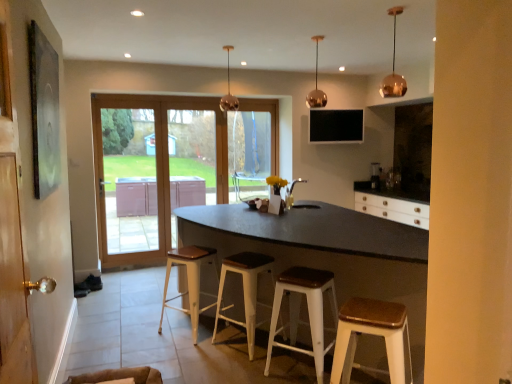
Question: Is point (207, 248) closer or farther from the camera than point (262, 127)?

Choices:
 (A) farther
 (B) closer

Answer: (B)

Question: From a real-world perspective, is white wood stool at center, placed as the first stool when sorted from back to front, physically located above or below transparent glass window at center?

Choices:
 (A) below
 (B) above

Answer: (A)

Question: Considering the real-world distances, which object is closest to the metallic gold pendant light at upper center, arranged as the first light fixture when viewed from the left?

Choices:
 (A) matte glass door at center
 (B) white wood stool at lower right, which ranks as the fourth stool in back-to-front order
 (C) white wood stool at center, placed as the first stool when sorted from back to front
 (D) metallic silver blender at center
 (E) white wood stool at center, which is counted as the 2th stool, starting from the back

Answer: (A)

Question: Which is farther from the matte silver sink at center?

Choices:
 (A) black matte table at center
 (B) matte glass door at center
 (C) transparent glass window at center
 (D) metallic gold pendant light at upper center, placed as the first light fixture when sorted from back to front
 (E) white wood stool at center, the 3th stool viewed from the front

Answer: (B)